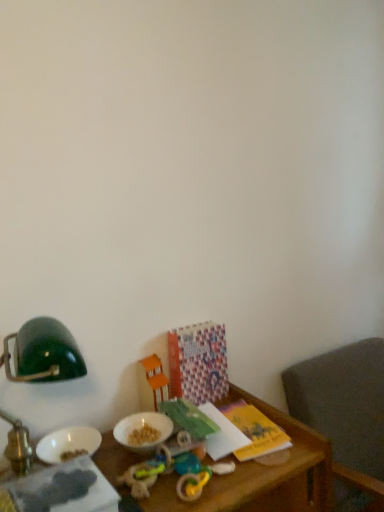
Where is `unoccupied space behind rubber teething ring at lower center, the first toy when ordered from front to back`? The width and height of the screenshot is (384, 512). unoccupied space behind rubber teething ring at lower center, the first toy when ordered from front to back is located at coordinates (222, 453).